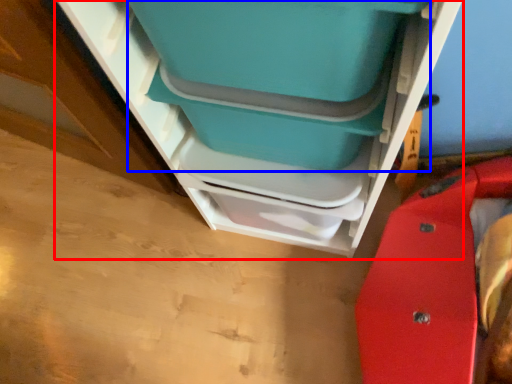
Question: Among these objects, which one is farthest to the camera, furniture (highlighted by a red box) or turquoise (highlighted by a blue box)?

Choices:
 (A) furniture
 (B) turquoise

Answer: (B)